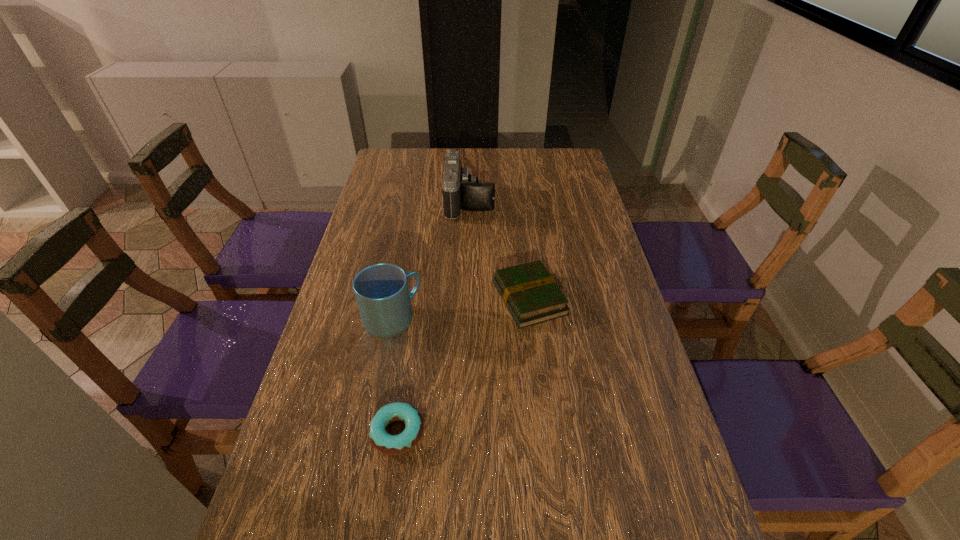
You are a GUI agent. You are given a task and a screenshot of the screen. Output one action in this format:
    pyautogui.click(x=<x>, y=<y>)
    Task: Click on the free space between the mug and the farthest object
    Image resolution: width=960 pixels, height=540 pixels.
    Given the screenshot: What is the action you would take?
    pyautogui.click(x=431, y=261)

Identify the location of free space between the nearest object and the mug. This screenshot has height=540, width=960. (395, 376).

Where is `empty location between the nearest object and the camera`? This screenshot has width=960, height=540. empty location between the nearest object and the camera is located at coordinates (434, 318).

The width and height of the screenshot is (960, 540). In order to click on empty space between the nearest object and the book in this screenshot , I will do `click(464, 366)`.

Identify the location of free space between the camera and the third tallest object. (499, 251).

Identify which object is the second nearest to the third tallest object. Please provide its 2D coordinates. Your answer should be formatted as a tuple, i.e. [(x, y)], where the tuple contains the x and y coordinates of a point satisfying the conditions above.

[(461, 190)]

Image resolution: width=960 pixels, height=540 pixels. In order to click on object that is the closest to the mug in this screenshot , I will do `click(530, 293)`.

At what (x,y) coordinates should I click in order to perform the action: click on vacant region that satisfies the following two spatial constraints: 1. on the back side of the second shortest object; 2. at the front of the farthest object with an open lens cover. Please return your answer as a coordinate pair (x, y). Image resolution: width=960 pixels, height=540 pixels. Looking at the image, I should click on (518, 202).

Find the location of a particular element. vacant position in the image that satisfies the following two spatial constraints: 1. at the front of the farthest object with an open lens cover; 2. on the back side of the third tallest object is located at coordinates (467, 299).

I want to click on blank area in the image that satisfies the following two spatial constraints: 1. at the front of the camera with an open lens cover; 2. on the front side of the shortest object, so click(463, 433).